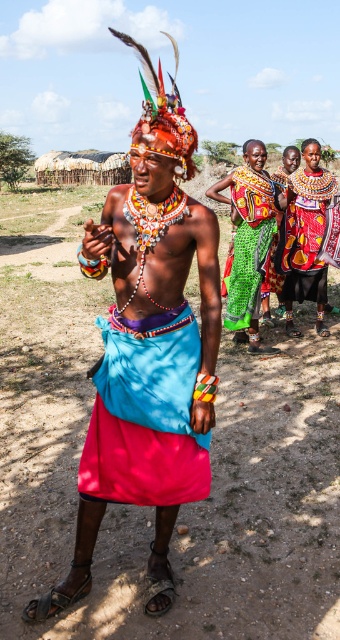
Does shiny fabric skirt at center appear on the right side of green woven skirt at center?

In fact, shiny fabric skirt at center is to the left of green woven skirt at center.

Measure the distance between shiny fabric skirt at center and camera.

shiny fabric skirt at center is 7.86 feet from camera.

Locate an element on the screen. The height and width of the screenshot is (640, 340). shiny fabric skirt at center is located at coordinates (145, 416).

Can you confirm if shiny multicolored headdress at center is positioned to the right of shiny fabric skirt at center?

No, shiny multicolored headdress at center is not to the right of shiny fabric skirt at center.

You are a GUI agent. You are given a task and a screenshot of the screen. Output one action in this format:
    pyautogui.click(x=<x>, y=<y>)
    Task: Click on the shiny multicolored headdress at center
    This screenshot has width=340, height=640.
    Given the screenshot: What is the action you would take?
    pyautogui.click(x=148, y=337)

Which is above, shiny fabric skirt at center or shiny red skirt at center?

Positioned higher is shiny red skirt at center.

Does shiny fabric skirt at center have a greater width compared to shiny red skirt at center?

In fact, shiny fabric skirt at center might be narrower than shiny red skirt at center.

Identify the location of shiny fabric skirt at center. (145, 416).